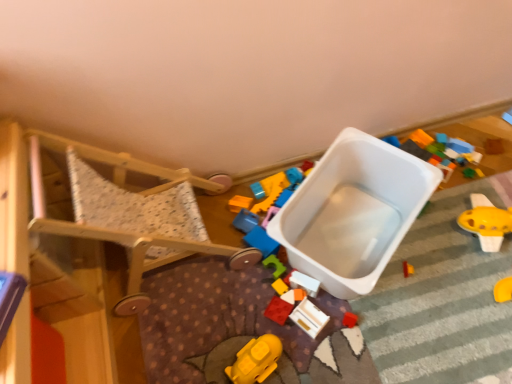
In order to click on vacant region to the left of yellow plastic toy at right, which is counted as the first toy, starting from the right in this screenshot , I will do `click(429, 247)`.